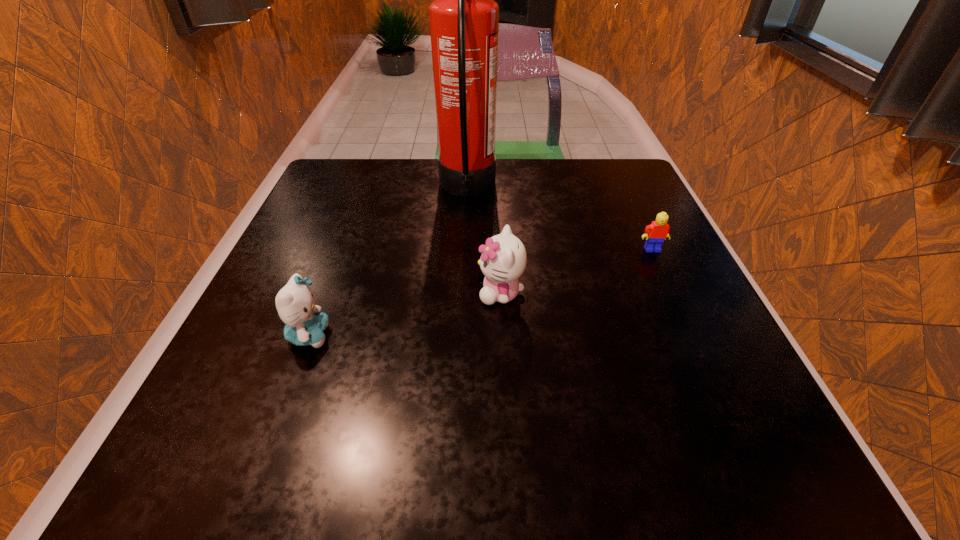
At what (x,y) coordinates should I click in order to perform the action: click on vacant space situated on the front-facing side of the right kitten. Please return your answer as a coordinate pair (x, y). The image size is (960, 540). Looking at the image, I should click on pos(367,293).

I want to click on free region located 0.050m on the front-facing side of the right kitten, so click(450, 293).

You are a GUI agent. You are given a task and a screenshot of the screen. Output one action in this format:
    pyautogui.click(x=<x>, y=<y>)
    Task: Click on the free space located 0.260m on the face of the leftmost object
    
    Given the screenshot: What is the action you would take?
    pyautogui.click(x=489, y=335)

Find the location of a particular element. The image size is (960, 540). vacant space positioned on the front-facing side of the third nearest object is located at coordinates (723, 402).

Find the location of a particular element. object present at the far edge is located at coordinates (464, 18).

I want to click on object that is at the left edge, so click(305, 324).

Image resolution: width=960 pixels, height=540 pixels. Find the location of `object present at the right edge`. object present at the right edge is located at coordinates (655, 233).

At what (x,y) coordinates should I click in order to perform the action: click on blank space at the far edge of the desktop. Please return your answer as a coordinate pair (x, y). This screenshot has width=960, height=540. Looking at the image, I should click on (506, 182).

The width and height of the screenshot is (960, 540). In the image, there is a desktop. Identify the location of vacant space at the near edge. (534, 480).

Where is `vacant space at the left edge of the desktop`? Image resolution: width=960 pixels, height=540 pixels. vacant space at the left edge of the desktop is located at coordinates (333, 312).